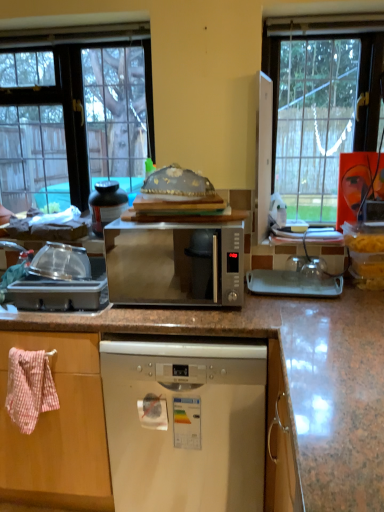
Question: From the image's perspective, is satin silver microwave at center on top of pink woven towel at left?

Choices:
 (A) no
 (B) yes

Answer: (B)

Question: Can you confirm if satin silver microwave at center is thinner than pink woven towel at left?

Choices:
 (A) no
 (B) yes

Answer: (A)

Question: Does satin silver microwave at center come behind pink woven towel at left?

Choices:
 (A) no
 (B) yes

Answer: (A)

Question: Is pink woven towel at left located within satin silver microwave at center?

Choices:
 (A) yes
 (B) no

Answer: (B)

Question: From a real-world perspective, is satin silver microwave at center beneath pink woven towel at left?

Choices:
 (A) yes
 (B) no

Answer: (B)

Question: From the image's perspective, is clear glass window at upper left positioned above or below clear plastic container at left, the first appliance viewed from the front?

Choices:
 (A) below
 (B) above

Answer: (B)

Question: Considering the positions of clear glass window at upper left and clear plastic container at left, which ranks as the first appliance in bottom-to-top order, in the image, is clear glass window at upper left wider or thinner than clear plastic container at left, which ranks as the first appliance in bottom-to-top order,?

Choices:
 (A) wide
 (B) thin

Answer: (B)

Question: From a real-world perspective, is clear glass window at upper left above or below clear plastic container at left, which ranks as the first appliance in bottom-to-top order?

Choices:
 (A) below
 (B) above

Answer: (B)

Question: Is clear glass window at upper left in front of or behind clear plastic container at left, the first appliance viewed from the front, in the image?

Choices:
 (A) front
 (B) behind

Answer: (B)

Question: Looking at the image, does pink woven towel at left seem bigger or smaller compared to satin silver microwave at center?

Choices:
 (A) small
 (B) big

Answer: (A)

Question: From the image's perspective, relative to satin silver microwave at center, is pink woven towel at left above or below?

Choices:
 (A) below
 (B) above

Answer: (A)

Question: From a real-world perspective, is pink woven towel at left physically located above or below satin silver microwave at center?

Choices:
 (A) above
 (B) below

Answer: (B)

Question: Is pink woven towel at left wider or thinner than satin silver microwave at center?

Choices:
 (A) wide
 (B) thin

Answer: (B)

Question: In terms of height, does pink woven towel at left look taller or shorter compared to clear glass window at upper left?

Choices:
 (A) tall
 (B) short

Answer: (B)

Question: Looking at their shapes, would you say pink woven towel at left is wider or thinner than clear glass window at upper left?

Choices:
 (A) wide
 (B) thin

Answer: (A)